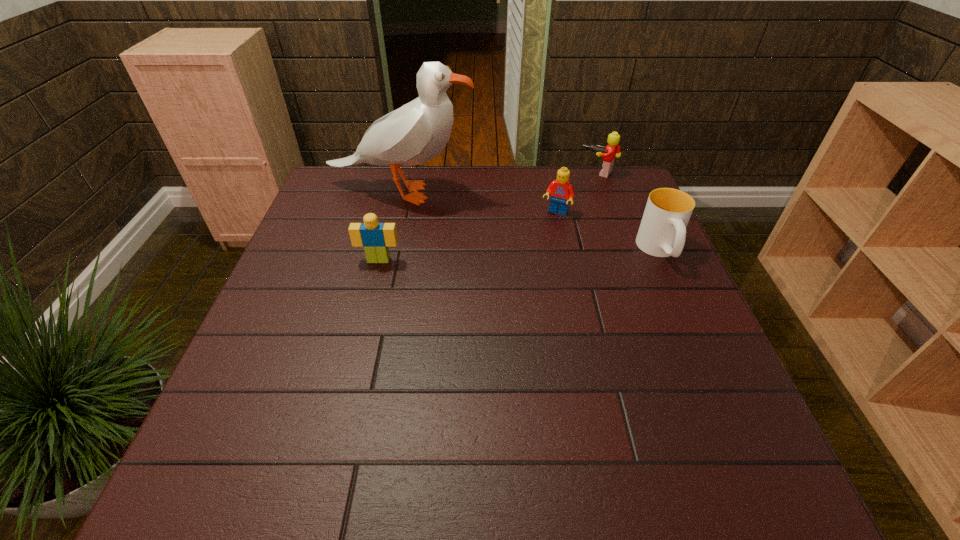
Locate an element on the screen. This screenshot has width=960, height=540. vacant area situated 0.120m on the face of the second farthest Lego is located at coordinates (537, 244).

What are the coordinates of `vacant position located in front of the rightmost Lego with the accessory visible` in the screenshot? It's located at (569, 204).

Find the location of a particular element. Image resolution: width=960 pixels, height=540 pixels. free spot located in front of the rightmost Lego with the accessory visible is located at coordinates (539, 243).

The image size is (960, 540). What are the coordinates of `vacant region located in front of the rightmost Lego with the accessory visible` in the screenshot? It's located at (557, 220).

You are a GUI agent. You are given a task and a screenshot of the screen. Output one action in this format:
    pyautogui.click(x=<x>, y=<y>)
    Task: Click on the free location located at the beak of the tallest object
    The height and width of the screenshot is (540, 960).
    Given the screenshot: What is the action you would take?
    pyautogui.click(x=524, y=233)

Identify the location of free region located at the beak of the tallest object. (537, 239).

Identify the location of free location located at the beak of the tallest object. The image size is (960, 540). (530, 235).

Locate an element on the screen. The image size is (960, 540). gull located at the far edge is located at coordinates (415, 133).

This screenshot has width=960, height=540. What are the coordinates of `object situated at the left edge` in the screenshot? It's located at (415, 133).

Find the location of a particular element. cup located at the right edge is located at coordinates (662, 232).